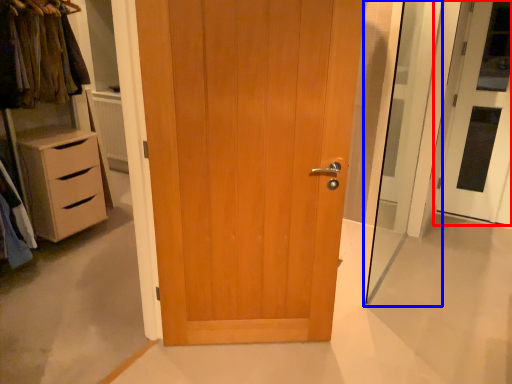
Question: Which point is closer to the camera, door (highlighted by a red box) or screen door (highlighted by a blue box)?

Choices:
 (A) door
 (B) screen door

Answer: (B)